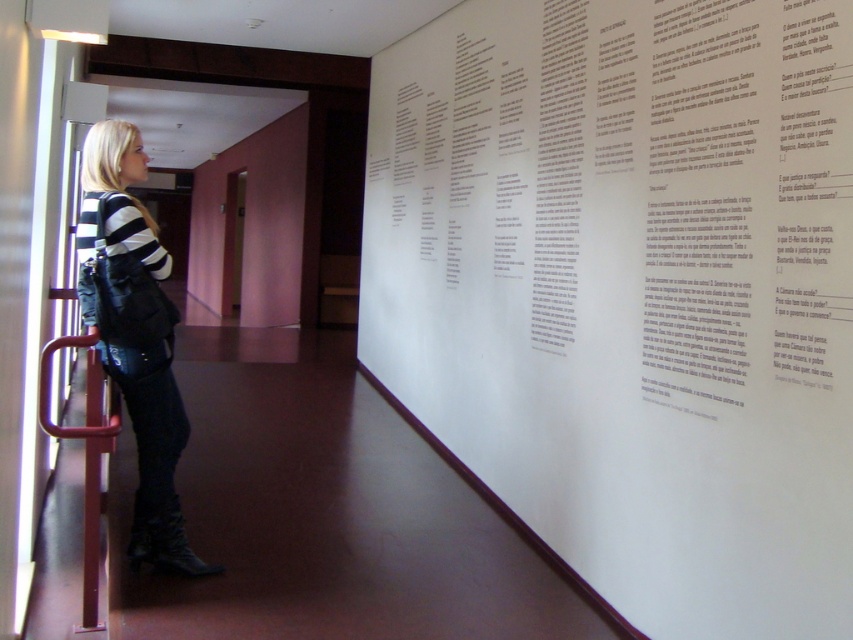
Who is taller, black leather boots at lower left or metallic red handrail at lower left?

black leather boots at lower left is taller.

What do you see at coordinates (136, 337) in the screenshot?
I see `black leather boots at lower left` at bounding box center [136, 337].

Find the location of a particular element. black leather boots at lower left is located at coordinates (136, 337).

Can you confirm if white paper at upper center is thinner than metallic red handrail at lower left?

No.

Which is behind, point (799, 80) or point (113, 442)?

The point (113, 442) is behind.

Does point (527, 124) come behind point (83, 586)?

Yes.

This screenshot has width=853, height=640. In order to click on white paper at upper center in this screenshot , I will do `click(631, 289)`.

Is white paper at upper center in front of black leather boots at lower left?

Yes, it is in front of black leather boots at lower left.

Between point (387, 195) and point (146, 465), which one is positioned in front?

Positioned in front is point (146, 465).

Locate an element on the screen. The height and width of the screenshot is (640, 853). white paper at upper center is located at coordinates (631, 289).